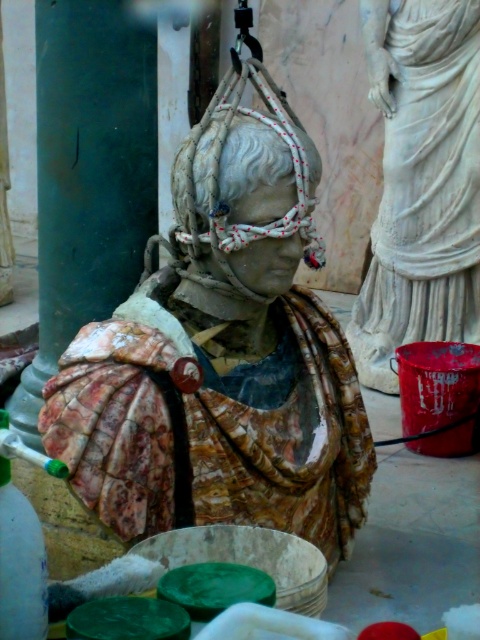
Which is above, marble bust at center or white marble statue at upper right?

Positioned higher is white marble statue at upper right.

Can you confirm if marble bust at center is positioned to the left of white marble statue at upper right?

Correct, you'll find marble bust at center to the left of white marble statue at upper right.

Find the location of a particular element. Image resolution: width=480 pixels, height=640 pixels. marble bust at center is located at coordinates (220, 358).